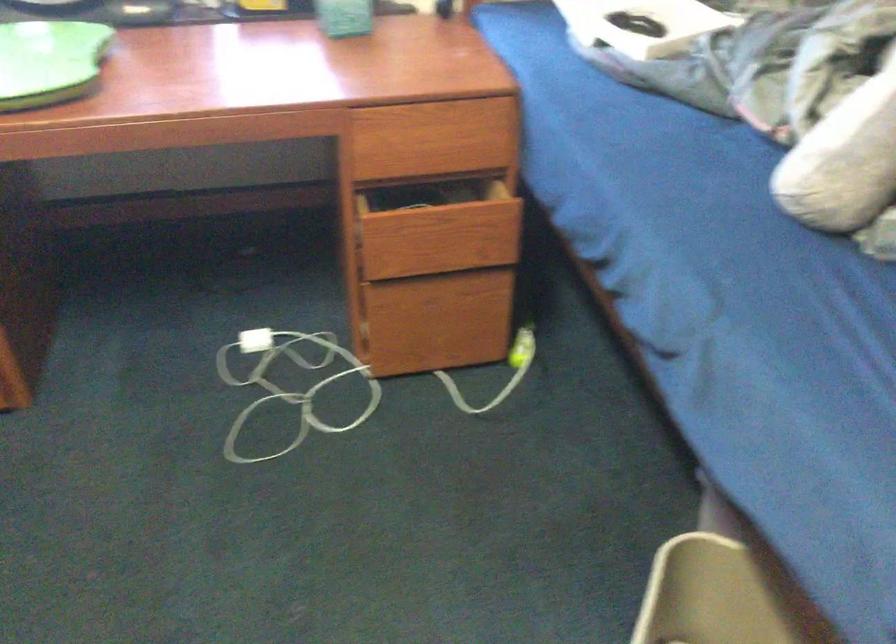
The location [289,383] corresponds to which object?

It refers to a white power adapter.